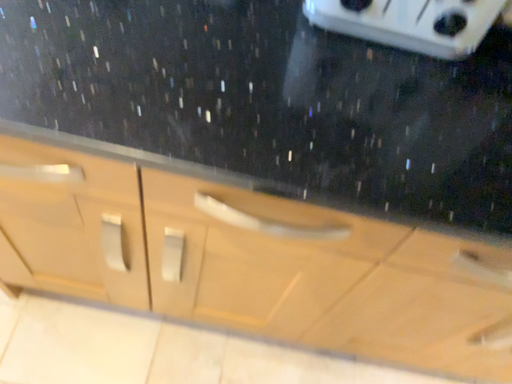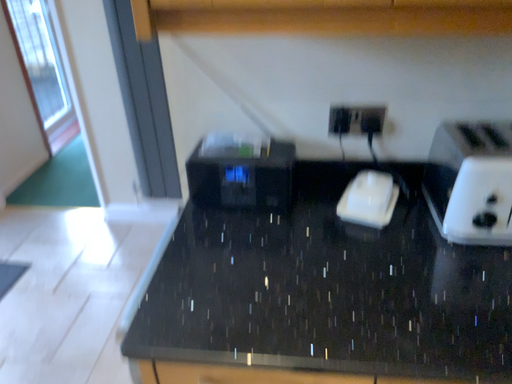
Question: Which way did the camera rotate in the video?

Choices:
 (A) rotated downward
 (B) rotated upward

Answer: (B)